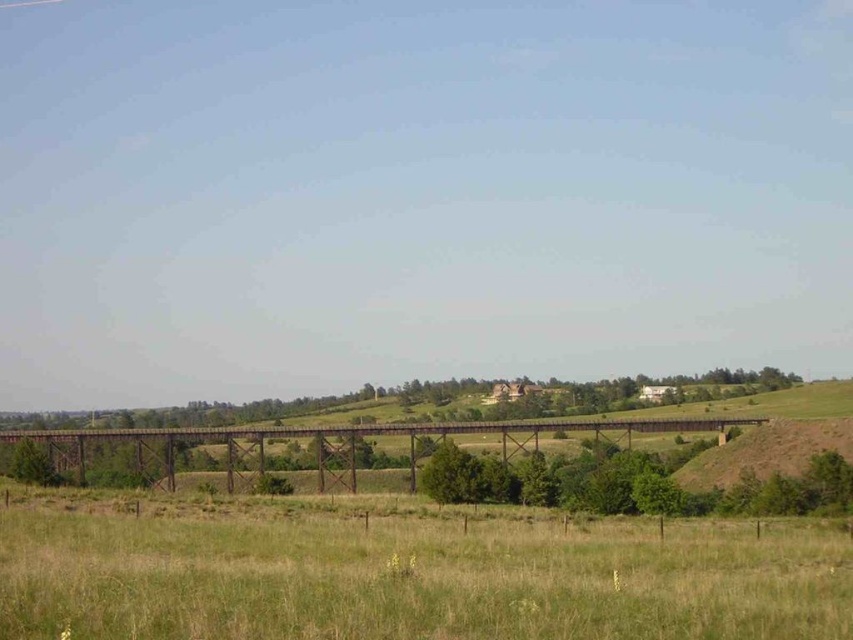
You are a hiker standing on the green grassy field at lower center. You want to climb up to the rusty metal bridge at center. Is the bridge higher than the field?

The green grassy field at lower center is not as tall as the rusty metal bridge at center, which means the bridge is higher than the field. Yes, the bridge is higher than the field.

You are standing on the path next to the green grassy field at lower center and want to cross to the rusty metal bridge at center. Which direction should you head to reach the bridge?

The green grassy field at lower center is to the right of the rusty metal bridge at center, so you should head to the left to reach the bridge.